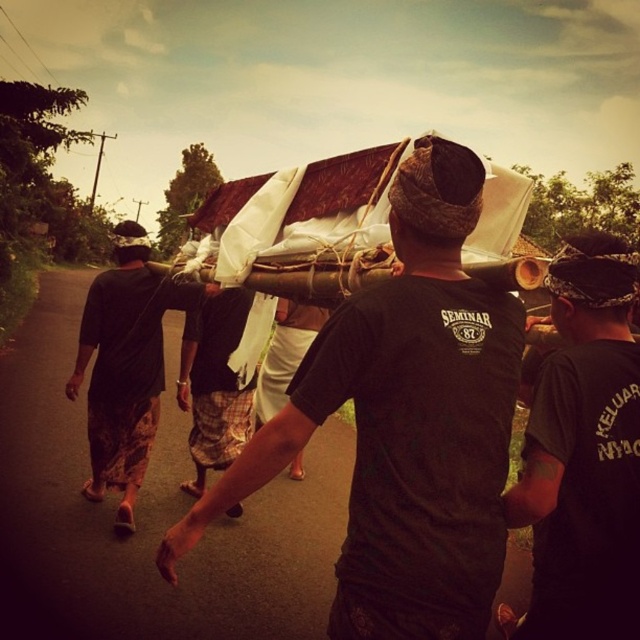
Consider the image. You are a photographer standing at the camera position. You notice a black fabric at center located at point (584, 452). What object in the scene is this black fabric part of?

The black fabric at center located at point (584, 452) is part of the coffin being carried by the group.

You are a photographer trying to capture the group carrying the coffin. You notice the brown woven basket at center and the black woven hat at upper left in your viewfinder. Which object is positioned more to the right side of the frame?

The brown woven basket at center is positioned to the right of the black woven hat at upper left, so the brown woven basket at center is more to the right side of the frame.

You are a photographer trying to capture the group carrying the coffin. You notice the black fabric at center and the brown woven hat at center. Which object should you focus on first if you want to photograph the one that is on the left side?

The brown woven hat at center is on the left side, so you should focus on it first.